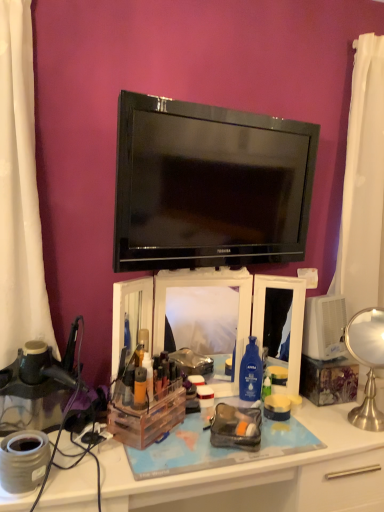
Locate an element on the screen. vacant area to the left of polished silver table lamp at right is located at coordinates pos(320,423).